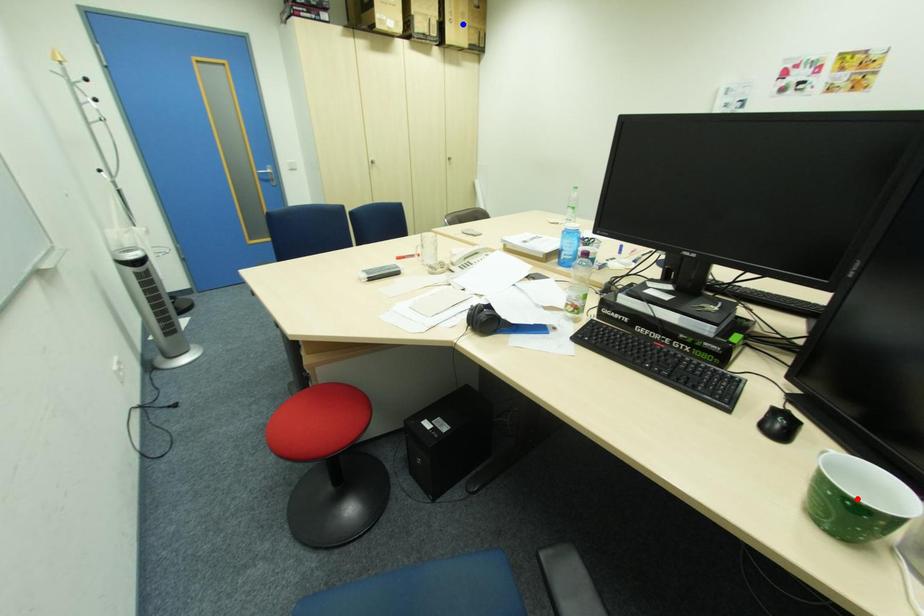
Question: In the image, two points are highlighted. Which point is nearer to the camera? Reply with the corresponding letter.

Choices:
 (A) blue point
 (B) red point

Answer: (B)